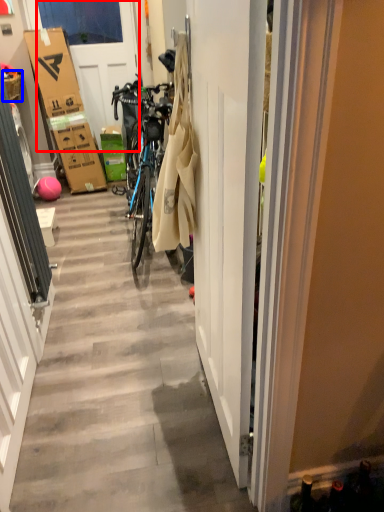
Question: Which of the following is the closest to the observer, door (highlighted by a red box) or picnic basket (highlighted by a blue box)?

Choices:
 (A) door
 (B) picnic basket

Answer: (B)